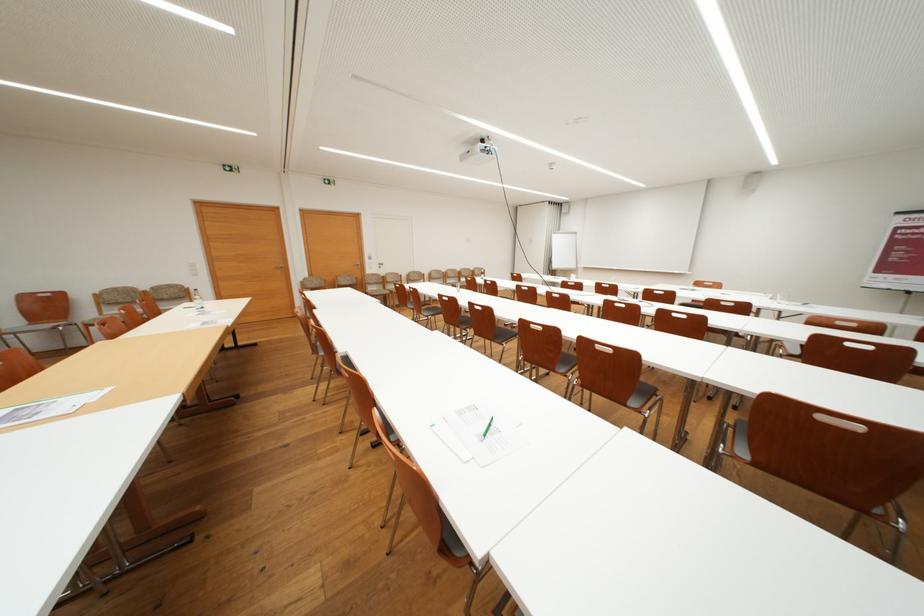
The location [785,300] corresponds to which object?

It refers to a drinking glass.